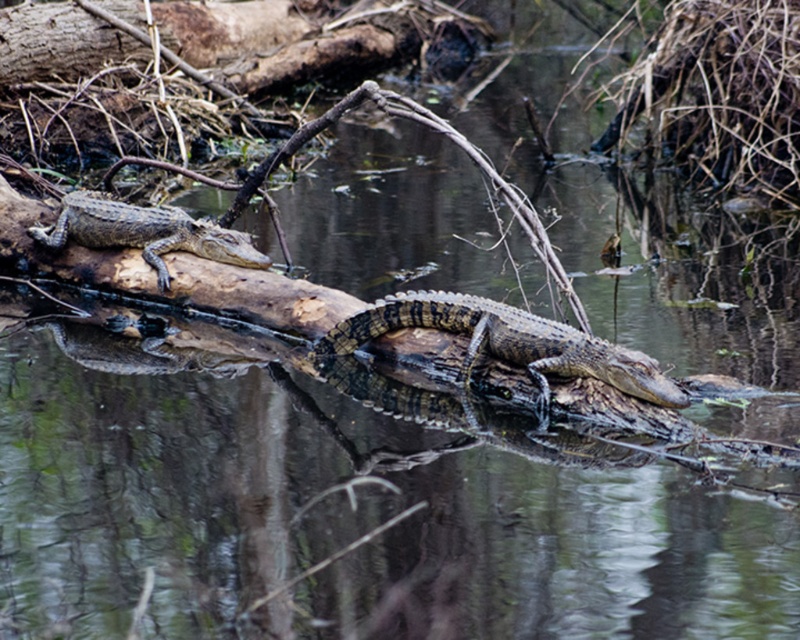
How distant is shiny brown crocodile at center from shiny brown crocodile at upper left?

6.31 feet

This screenshot has width=800, height=640. Describe the element at coordinates (508, 342) in the screenshot. I see `shiny brown crocodile at center` at that location.

This screenshot has width=800, height=640. Identify the location of shiny brown crocodile at center. (508, 342).